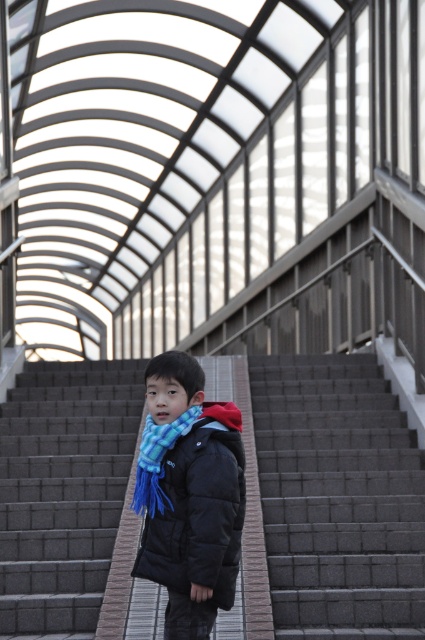
Question: Based on their relative distances, which object is farther from the gray concrete stairs at center?

Choices:
 (A) black puffy jacket at center
 (B) blue plaid scarf at center

Answer: (B)

Question: In this image, where is black puffy jacket at center located relative to blue plaid scarf at center?

Choices:
 (A) left
 (B) right

Answer: (B)

Question: Is gray concrete stairs at center to the right of black puffy jacket at center from the viewer's perspective?

Choices:
 (A) yes
 (B) no

Answer: (A)

Question: Which of these objects is positioned farthest from the blue plaid scarf at center?

Choices:
 (A) gray concrete stairs at center
 (B) black puffy jacket at center

Answer: (A)

Question: Which is farther from the blue plaid scarf at center?

Choices:
 (A) gray concrete stairs at center
 (B) black puffy jacket at center

Answer: (A)

Question: Can you confirm if gray concrete stairs at center is positioned to the right of black puffy jacket at center?

Choices:
 (A) no
 (B) yes

Answer: (B)